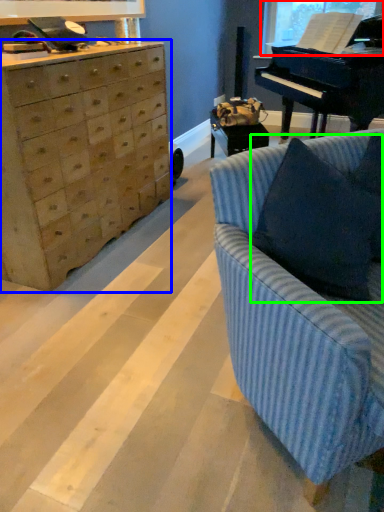
Question: Considering the real-world distances, which object is farthest from window screen (highlighted by a red box)? chest of drawers (highlighted by a blue box) or pillow (highlighted by a green box)?

Choices:
 (A) chest of drawers
 (B) pillow

Answer: (B)